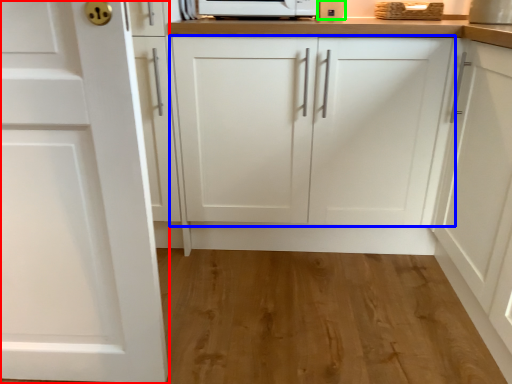
Question: Based on their relative distances, which object is farther from cabinetry (highlighted by a red box)? Choose from cabinetry (highlighted by a blue box) and appliance (highlighted by a green box).

Choices:
 (A) cabinetry
 (B) appliance

Answer: (B)